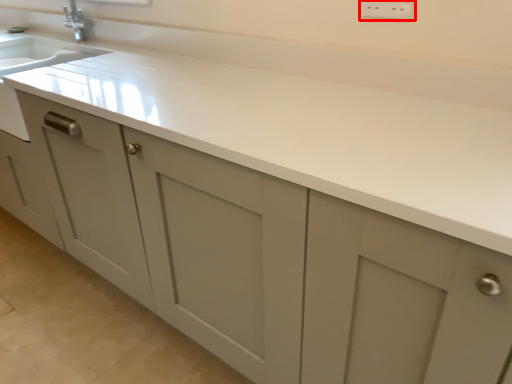
Question: From the image's perspective, where is electric outlet (annotated by the red box) located relative to countertop?

Choices:
 (A) below
 (B) above

Answer: (B)